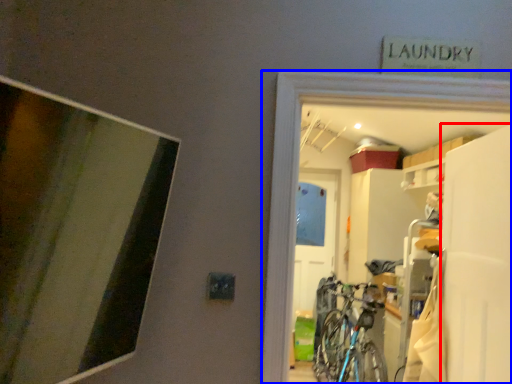
Question: Which point is further to the camera, screen door (highlighted by a red box) or garage (highlighted by a blue box)?

Choices:
 (A) screen door
 (B) garage

Answer: (A)